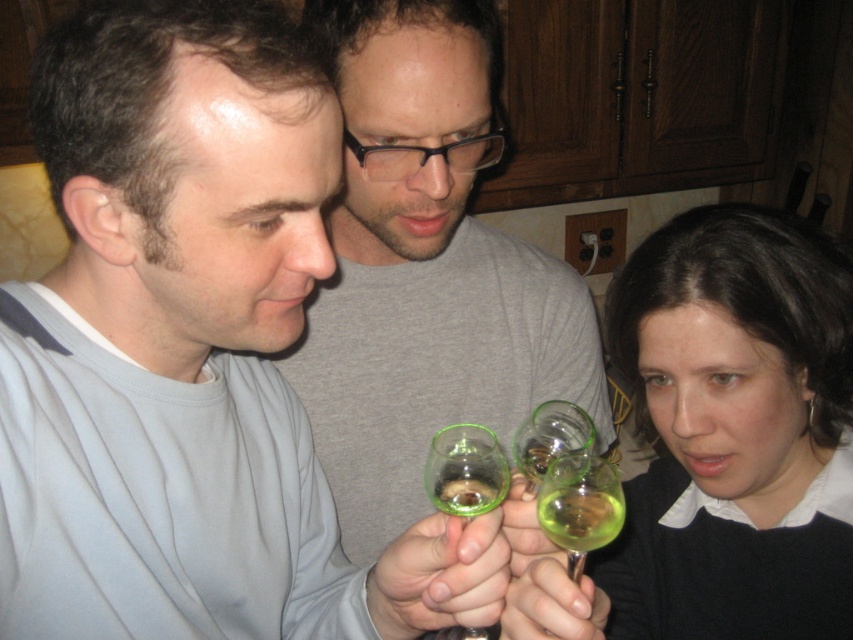
Question: Is matte glass wine glass at center closer to camera compared to translucent green glass at lower center?

Choices:
 (A) no
 (B) yes

Answer: (B)

Question: Is the position of translucent green glass at lower center more distant than that of green glass at center?

Choices:
 (A) yes
 (B) no

Answer: (B)

Question: Which point is farther to the camera?

Choices:
 (A) translucent green glass at lower center
 (B) matte glass wine glass at center
 (C) green glass at center
 (D) green translucent glass at center

Answer: (C)

Question: Which object appears farthest from the camera in this image?

Choices:
 (A) green glass wine glass at center
 (B) green translucent glass at center
 (C) green glass at center

Answer: (A)

Question: Which object is farther from the camera taking this photo?

Choices:
 (A) matte glass wine glass at center
 (B) green glass wine glass at center

Answer: (B)

Question: Can you confirm if matte glass wine glass at center is thinner than transparent glass at center?

Choices:
 (A) no
 (B) yes

Answer: (A)